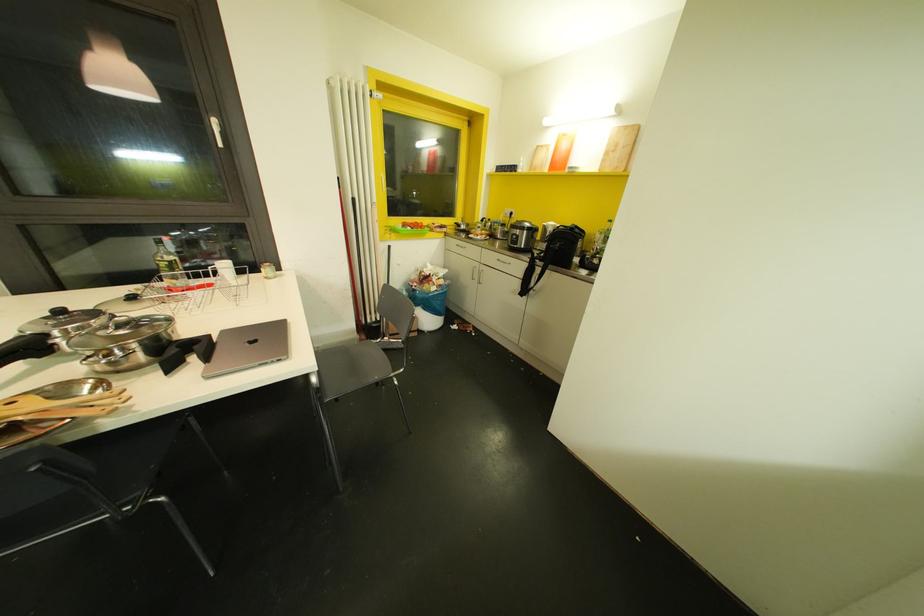
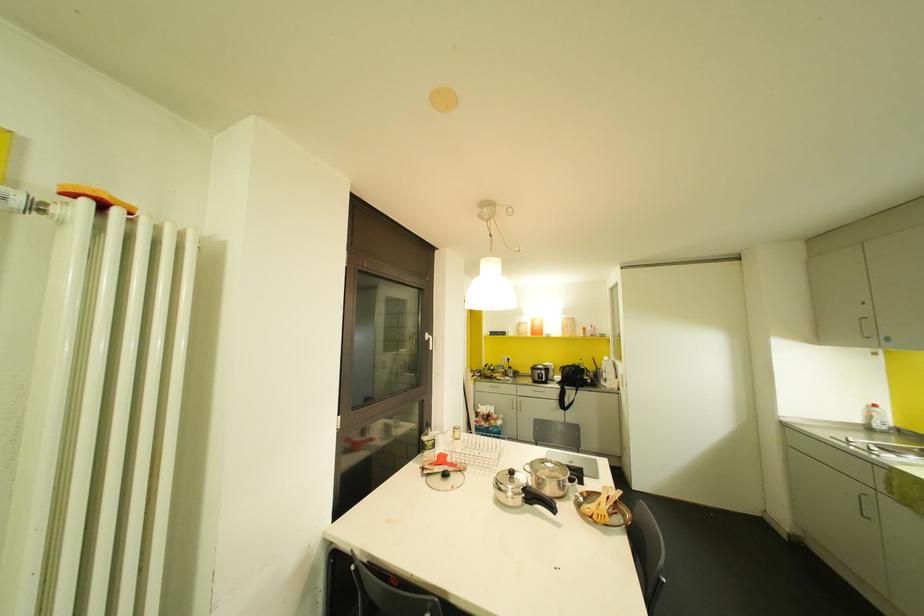
In the second image, find the point that corresponds to (x=558, y=163) in the first image.

(536, 331)